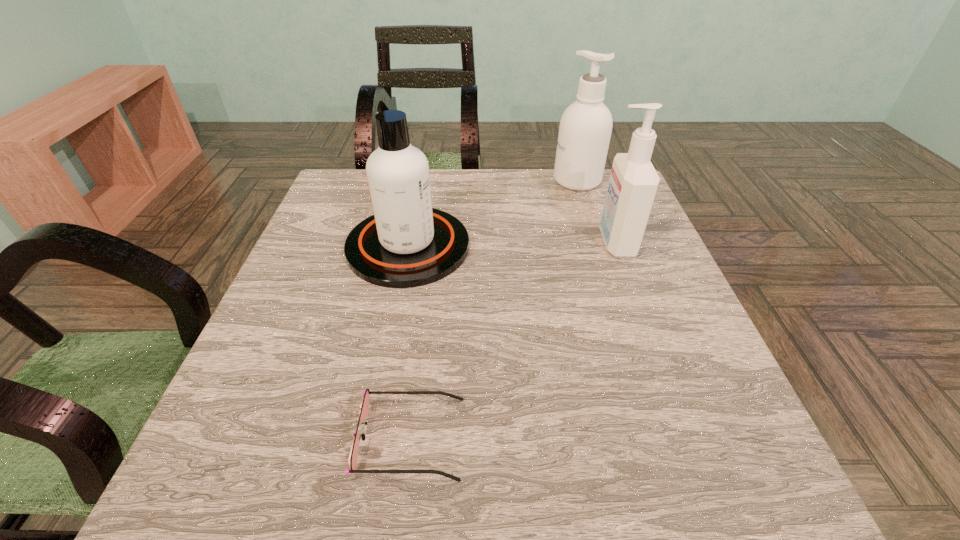
Locate which cleansing agent is the closest to the farthest cleansing agent. Please provide its 2D coordinates. Your answer should be formatted as a tuple, i.e. [(x, y)], where the tuple contains the x and y coordinates of a point satisfying the conditions above.

[(633, 183)]

Locate which cleansing agent is the closest to the farthest object. Please provide its 2D coordinates. Your answer should be formatted as a tuple, i.e. [(x, y)], where the tuple contains the x and y coordinates of a point satisfying the conditions above.

[(633, 183)]

Where is `vacant space that satisfies the following two spatial constraints: 1. on the front label of the farthest cleansing agent; 2. on the front side of the leftmost cleansing agent`? vacant space that satisfies the following two spatial constraints: 1. on the front label of the farthest cleansing agent; 2. on the front side of the leftmost cleansing agent is located at coordinates (598, 247).